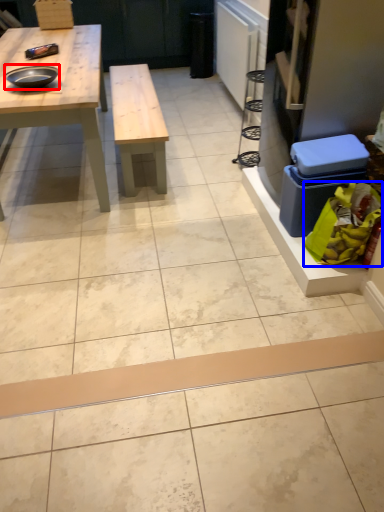
Question: Which object is closer to the camera taking this photo, tray (highlighted by a red box) or food (highlighted by a blue box)?

Choices:
 (A) tray
 (B) food

Answer: (B)